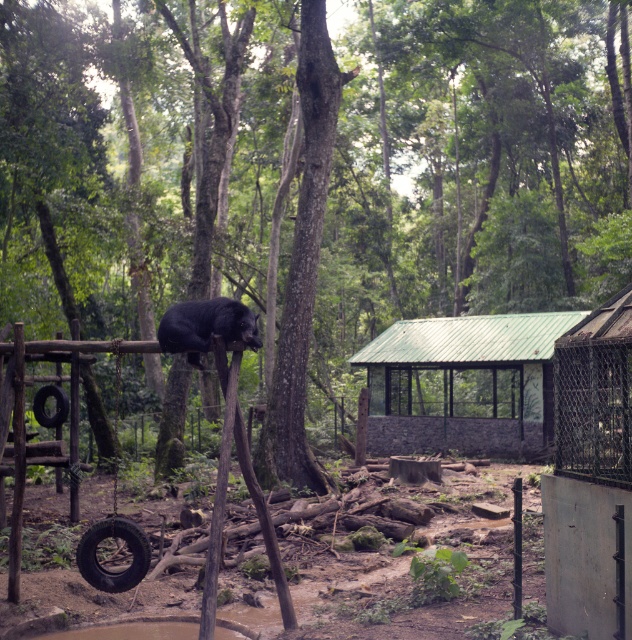
Does green corrugated metal hut at center have a lesser height compared to black rubber tire swing at lower left?

No, green corrugated metal hut at center is not shorter than black rubber tire swing at lower left.

Which is behind, point (547, 333) or point (142, 548)?

Point (547, 333)

Does point (538, 410) come farther from viewer compared to point (135, 545)?

Yes, point (538, 410) is behind point (135, 545).

The image size is (632, 640). Identify the location of green corrugated metal hut at center. (463, 385).

How much distance is there between rough bark tree at center and black rubber tire at lower left?

10.36 meters

Does rough bark tree at center come in front of black rubber tire at lower left?

No.

Between point (312, 64) and point (116, 528), which one is positioned in front?

Point (116, 528) is more forward.

You are a GUI agent. You are given a task and a screenshot of the screen. Output one action in this format:
    pyautogui.click(x=<x>, y=<y>)
    Task: Click on the rough bark tree at center
    The image size is (632, 640).
    Given the screenshot: What is the action you would take?
    pyautogui.click(x=301, y=260)

Can you confirm if green corrugated metal hut at center is positioned to the right of rough bark tree at center?

Yes, green corrugated metal hut at center is to the right of rough bark tree at center.

In order to click on green corrugated metal hut at center in this screenshot , I will do [463, 385].